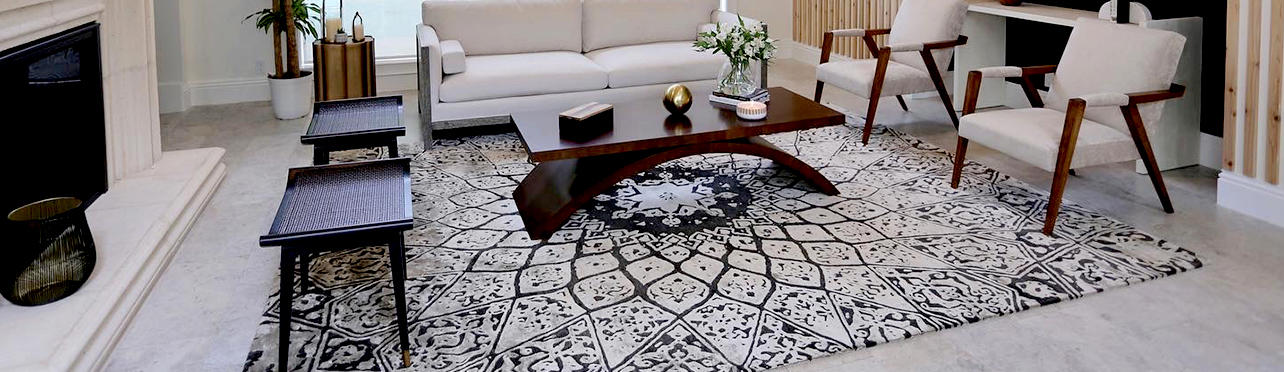
This screenshot has height=372, width=1284. Identify the location of table. (1048, 15), (659, 135), (340, 64).